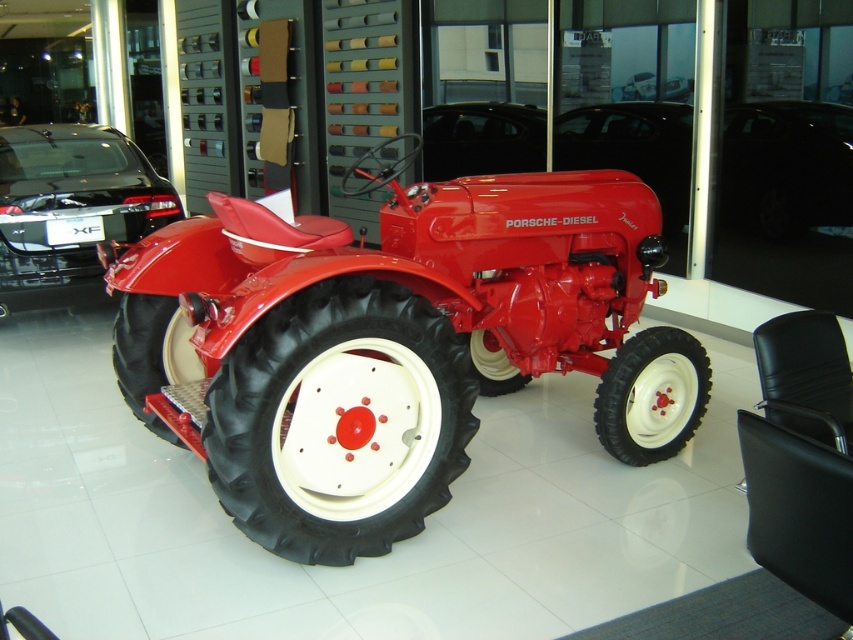
Who is higher up, matte red tractor at center or rubber/soft tractor tire at center?

matte red tractor at center

Is matte red tractor at center to the right of rubber/soft tractor tire at center from the viewer's perspective?

Yes, matte red tractor at center is to the right of rubber/soft tractor tire at center.

In order to click on matte red tractor at center in this screenshot , I will do `click(392, 340)`.

Is rubber/soft tractor tire at center shorter than glossy black car at left?

Yes.

Does point (383, 444) come behind point (96, 282)?

That is False.

This screenshot has height=640, width=853. I want to click on rubber/soft tractor tire at center, so click(x=339, y=420).

Is matte red tractor at center positioned in front of shiny black car at center?

Yes, it is in front of shiny black car at center.

Does matte red tractor at center appear on the left side of shiny black car at center?

Yes, matte red tractor at center is to the left of shiny black car at center.

Who is more distant from viewer, (273, 326) or (764, 186)?

The point (764, 186) is behind.

Where is `matte red tractor at center`? matte red tractor at center is located at coordinates (392, 340).